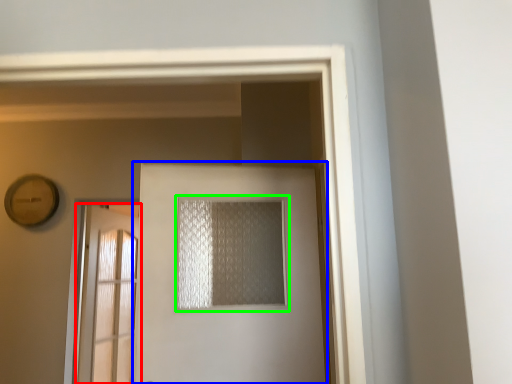
Question: Which is farther away from door (highlighted by a red box)? door (highlighted by a blue box) or window (highlighted by a green box)?

Choices:
 (A) door
 (B) window

Answer: (B)